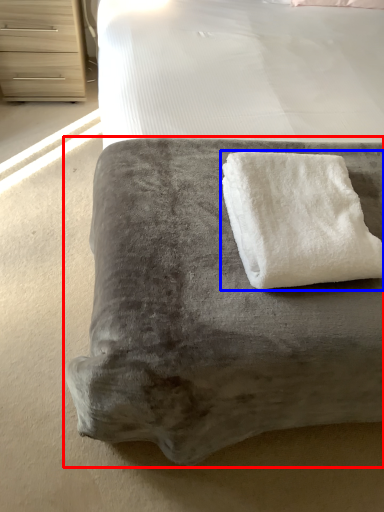
Question: Among these objects, which one is nearest to the camera, furniture (highlighted by a red box) or towel (highlighted by a blue box)?

Choices:
 (A) furniture
 (B) towel

Answer: (A)